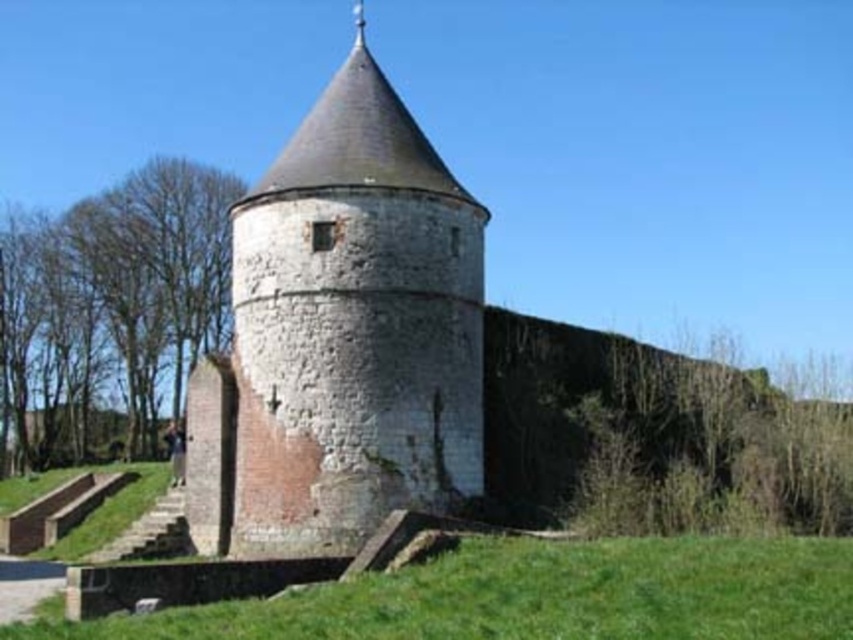
Question: Does white stone tower at center come behind green grass at lower center?

Choices:
 (A) no
 (B) yes

Answer: (B)

Question: Among these objects, which one is farthest from the camera?

Choices:
 (A) green grass at lower center
 (B) white stone tower at center

Answer: (B)

Question: Does white stone tower at center appear on the left side of green grass at lower center?

Choices:
 (A) yes
 (B) no

Answer: (A)

Question: Does white stone tower at center appear on the left side of green grass at lower center?

Choices:
 (A) no
 (B) yes

Answer: (B)

Question: Which point is farther to the camera?

Choices:
 (A) white stone tower at center
 (B) green grass at lower center

Answer: (A)